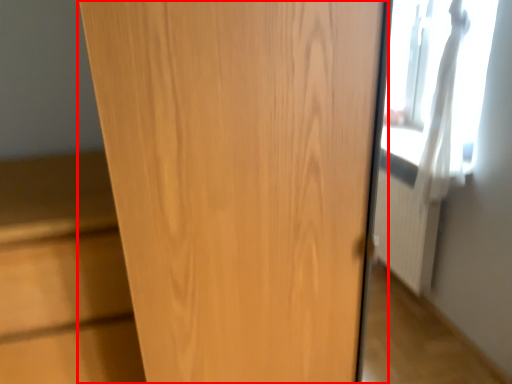
Question: From the image's perspective, where is door (annotated by the red box) located relative to cabinetry?

Choices:
 (A) below
 (B) above

Answer: (B)